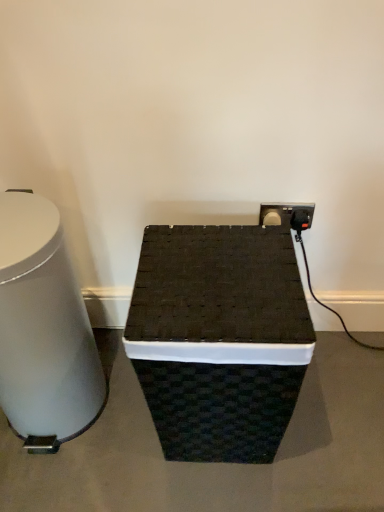
Question: From the image's perspective, is black woven basket at center above or below white glossy trash can at left?

Choices:
 (A) above
 (B) below

Answer: (B)

Question: Is black woven basket at center in front of or behind white glossy trash can at left in the image?

Choices:
 (A) behind
 (B) front

Answer: (A)

Question: Is black woven basket at center wider or thinner than white glossy trash can at left?

Choices:
 (A) thin
 (B) wide

Answer: (B)

Question: From their relative heights in the image, would you say white glossy trash can at left is taller or shorter than black woven basket at center?

Choices:
 (A) tall
 (B) short

Answer: (A)

Question: Looking at the image, does white glossy trash can at left seem bigger or smaller compared to black woven basket at center?

Choices:
 (A) big
 (B) small

Answer: (B)

Question: Relative to black woven basket at center, is white glossy trash can at left in front or behind?

Choices:
 (A) front
 (B) behind

Answer: (A)

Question: Considering the positions of white glossy trash can at left and black woven basket at center in the image, is white glossy trash can at left wider or thinner than black woven basket at center?

Choices:
 (A) thin
 (B) wide

Answer: (A)